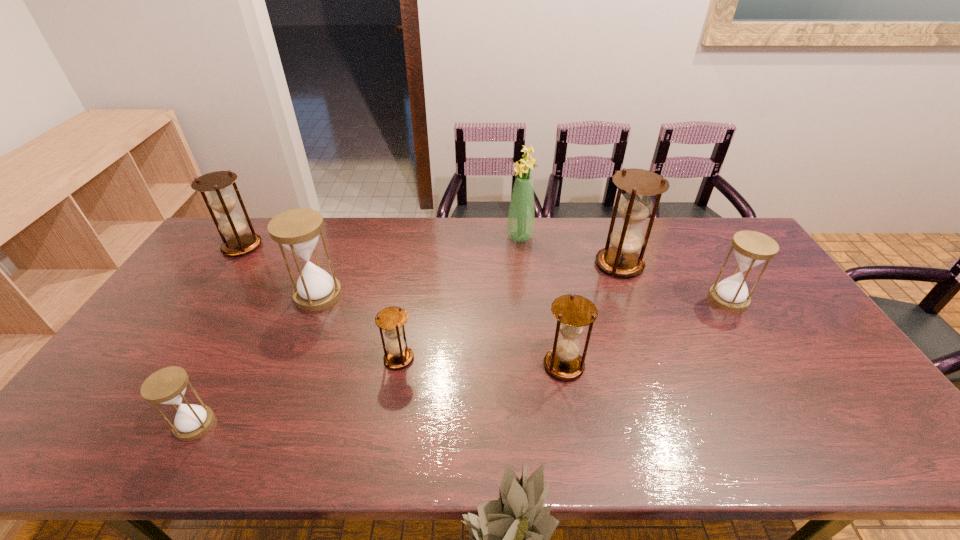
I want to click on free region that satisfies the following two spatial constraints: 1. on the back side of the nearest object; 2. on the right side of the fifth object from right to left, so click(230, 359).